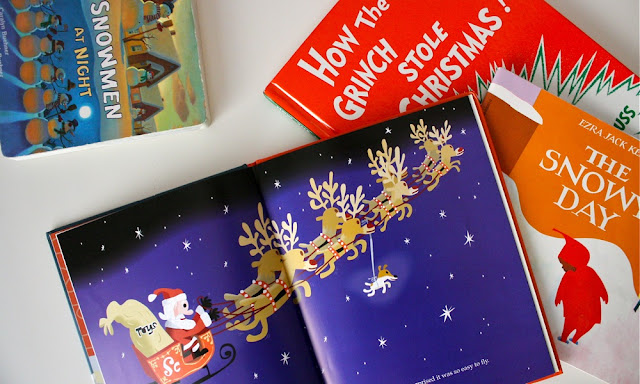
Locate an element on the screen. book is located at coordinates (308, 90).